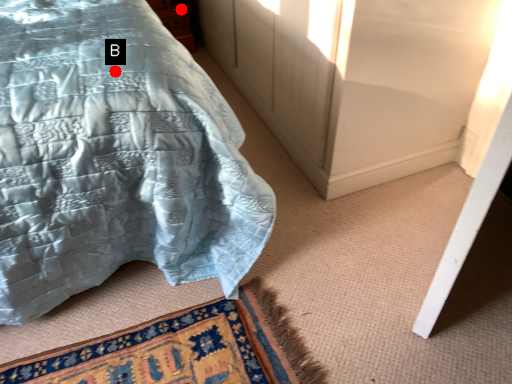
Question: Two points are circled on the image, labeled by A and B beside each circle. Which point appears farthest from the camera in this image?

Choices:
 (A) A is further
 (B) B is further

Answer: (A)